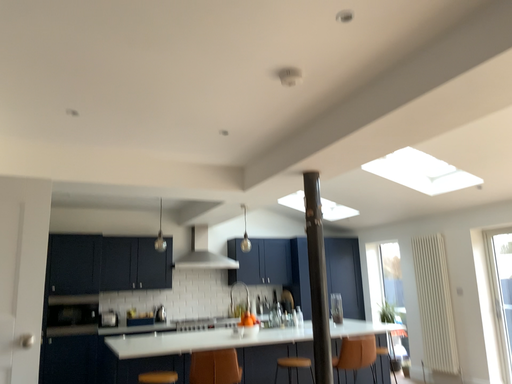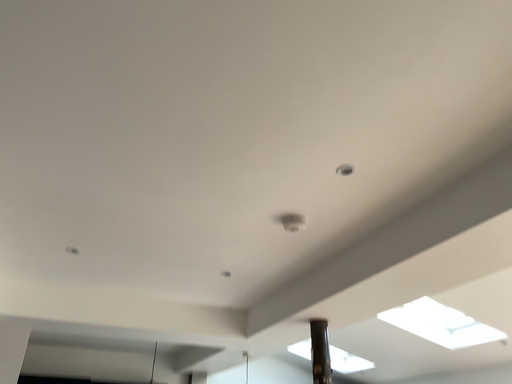
Question: How did the camera likely rotate when shooting the video?

Choices:
 (A) rotated upward
 (B) rotated downward

Answer: (A)